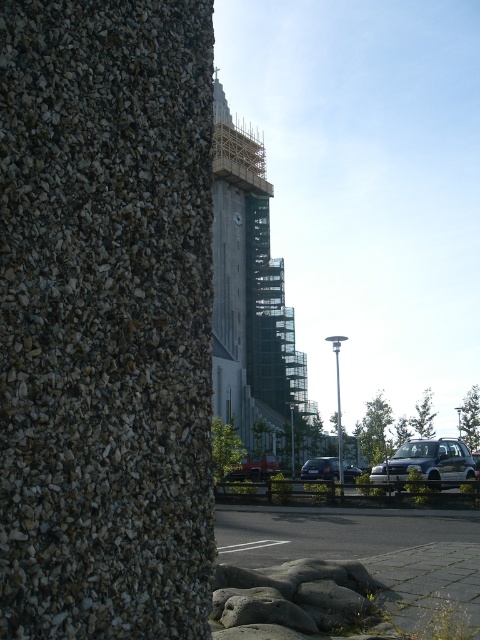
You are a delivery driver who needs to park your shiny silver sedan at center in a parking spot located behind the concrete scaffolding at center. Can your vehicle fit vertically behind the scaffolding without any part of it exceeding the height limit?

The concrete scaffolding at center has a greater height compared to the shiny silver sedan at center, so the vehicle can fit vertically behind the scaffolding without exceeding the height limit.

You are standing in front of the construction site and want to determine the relative positions of two points marked in the image. Which point, point (217, 234) or point (321, 476), is closer to you?

Point (217, 234) is closer to you because it is further to the viewer than point (321, 476).